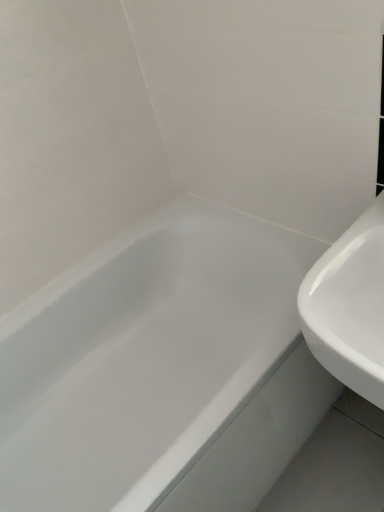
Question: Looking at the image, does white glossy bathtub at center seem bigger or smaller compared to white glossy sink at right?

Choices:
 (A) big
 (B) small

Answer: (A)

Question: Is white glossy bathtub at center in front of or behind white glossy sink at right in the image?

Choices:
 (A) behind
 (B) front

Answer: (A)

Question: Considering the positions of point (120, 241) and point (339, 369), is point (120, 241) closer or farther from the camera than point (339, 369)?

Choices:
 (A) farther
 (B) closer

Answer: (A)

Question: Considering the positions of point (364, 271) and point (43, 403), is point (364, 271) closer or farther from the camera than point (43, 403)?

Choices:
 (A) closer
 (B) farther

Answer: (A)

Question: Would you say white glossy sink at right is to the left or to the right of white glossy bathtub at center in the picture?

Choices:
 (A) left
 (B) right

Answer: (B)

Question: Is white glossy sink at right bigger or smaller than white glossy bathtub at center?

Choices:
 (A) big
 (B) small

Answer: (B)

Question: Considering their positions, is white glossy sink at right located in front of or behind white glossy bathtub at center?

Choices:
 (A) front
 (B) behind

Answer: (A)